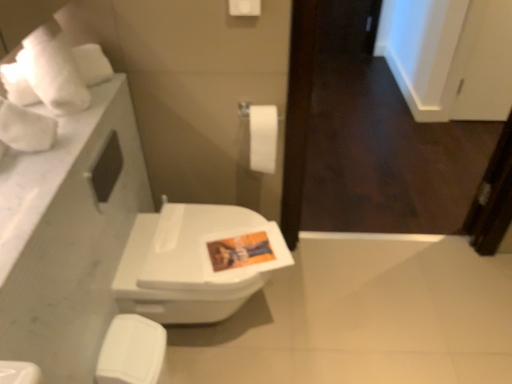
Locate an element on the screen. free location above white glossy toilet at center (from a real-world perspective) is located at coordinates (204, 240).